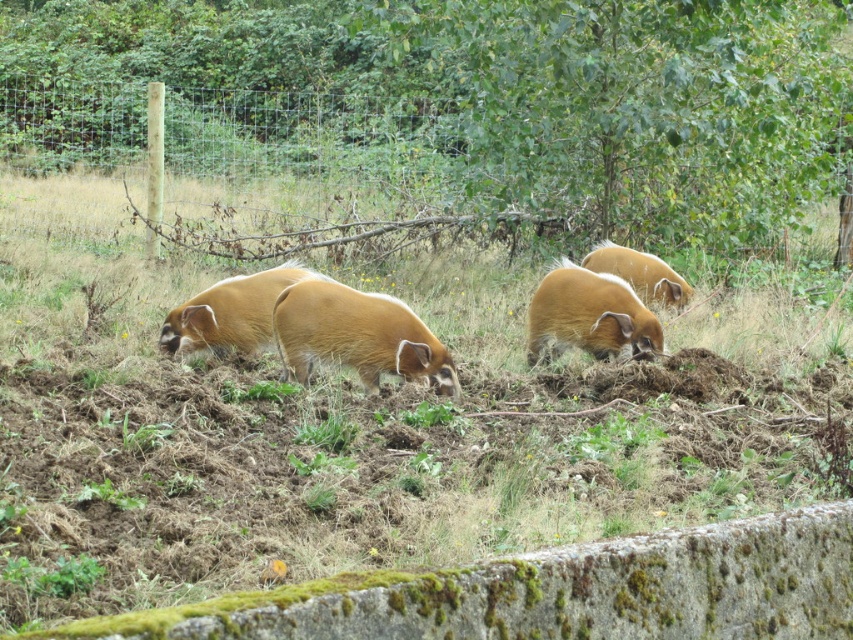
Is golden-brown fur pig at center smaller than golden fur boar at left?

Incorrect, golden-brown fur pig at center is not smaller in size than golden fur boar at left.

Is golden-brown fur pig at center wider than golden fur boar at left?

Incorrect, golden-brown fur pig at center's width does not surpass golden fur boar at left's.

Measure the distance between golden-brown fur pig at center and camera.

6.98 meters

Where is `golden-brown fur pig at center`? golden-brown fur pig at center is located at coordinates (589, 316).

In the scene shown: Is brown furry pig at center closer to camera compared to golden fur boar at left?

Yes.

Which is above, brown furry pig at center or golden fur boar at left?

Positioned higher is golden fur boar at left.

Is point (369, 294) positioned before point (158, 344)?

That is True.

Locate an element on the screen. brown furry pig at center is located at coordinates (x=357, y=336).

This screenshot has height=640, width=853. Describe the element at coordinates (381, 428) in the screenshot. I see `brown grass at center` at that location.

Is brown grass at center further to the viewer compared to golden-brown fur pig at center?

That is False.

Locate an element on the screen. The image size is (853, 640). brown grass at center is located at coordinates pos(381,428).

You are a GUI agent. You are given a task and a screenshot of the screen. Output one action in this format:
    pyautogui.click(x=<x>, y=<y>)
    Task: Click on the brown grass at center
    This screenshot has height=640, width=853.
    Given the screenshot: What is the action you would take?
    pyautogui.click(x=381, y=428)